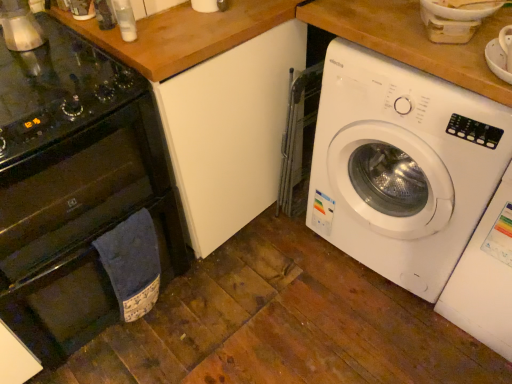
Question: Should I look upward or downward to see white plastic washing machine at right, the 2th washing machine viewed from the left?

Choices:
 (A) up
 (B) down

Answer: (B)

Question: Does white plastic washing machine at right, the first washing machine viewed from the right, turn towards white plastic washing machine at right, the 1th washing machine viewed from the left?

Choices:
 (A) yes
 (B) no

Answer: (B)

Question: From the image's perspective, is white plastic washing machine at right, the 2th washing machine viewed from the left, over white plastic washing machine at right, the 1th washing machine viewed from the left?

Choices:
 (A) yes
 (B) no

Answer: (B)

Question: Considering the relative sizes of white plastic washing machine at right, the first washing machine viewed from the right, and white plastic washing machine at right, the 1th washing machine viewed from the left, in the image provided, is white plastic washing machine at right, the first washing machine viewed from the right, smaller than white plastic washing machine at right, the 1th washing machine viewed from the left,?

Choices:
 (A) yes
 (B) no

Answer: (A)

Question: Is white plastic washing machine at right, the 2th washing machine viewed from the left, looking in the opposite direction of white plastic washing machine at right, the 2th washing machine from the right?

Choices:
 (A) no
 (B) yes

Answer: (A)

Question: Can you confirm if white plastic washing machine at right, the 2th washing machine viewed from the left, is taller than white plastic washing machine at right, the 1th washing machine viewed from the left?

Choices:
 (A) yes
 (B) no

Answer: (B)

Question: Can you confirm if white plastic washing machine at right, the 2th washing machine viewed from the left, is positioned to the left of white plastic washing machine at right, the 1th washing machine viewed from the left?

Choices:
 (A) no
 (B) yes

Answer: (A)

Question: Does white plastic washing machine at right, the 2th washing machine from the right, touch white plastic washing machine at right, the first washing machine viewed from the right?

Choices:
 (A) no
 (B) yes

Answer: (A)

Question: Could you tell me if white plastic washing machine at right, the 1th washing machine viewed from the left, is facing white plastic washing machine at right, the first washing machine viewed from the right?

Choices:
 (A) no
 (B) yes

Answer: (A)

Question: Can you confirm if white plastic washing machine at right, the 2th washing machine from the right, is positioned to the right of white plastic washing machine at right, the first washing machine viewed from the right?

Choices:
 (A) yes
 (B) no

Answer: (B)

Question: Can you confirm if white plastic washing machine at right, the 1th washing machine viewed from the left, is taller than white plastic washing machine at right, the first washing machine viewed from the right?

Choices:
 (A) no
 (B) yes

Answer: (B)

Question: Is white plastic washing machine at right, the first washing machine viewed from the right, at the back of white plastic washing machine at right, the 2th washing machine from the right?

Choices:
 (A) no
 (B) yes

Answer: (A)

Question: From the image's perspective, is white plastic washing machine at right, the 1th washing machine viewed from the left, beneath white plastic washing machine at right, the first washing machine viewed from the right?

Choices:
 (A) no
 (B) yes

Answer: (A)

Question: Considering the relative sizes of white plastic washing machine at right, the 1th washing machine viewed from the left, and metallic silver kettle at upper left in the image provided, is white plastic washing machine at right, the 1th washing machine viewed from the left, wider than metallic silver kettle at upper left?

Choices:
 (A) no
 (B) yes

Answer: (B)